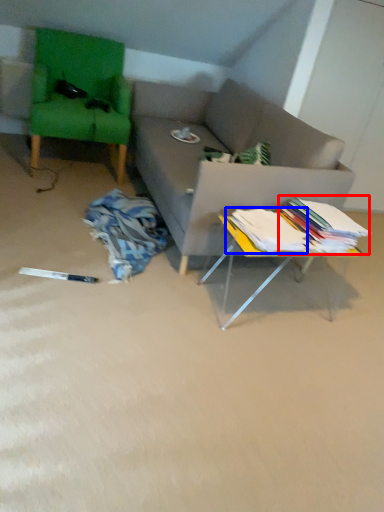
Question: Which object is further to the camera taking this photo, book (highlighted by a red box) or book (highlighted by a blue box)?

Choices:
 (A) book
 (B) book

Answer: (A)